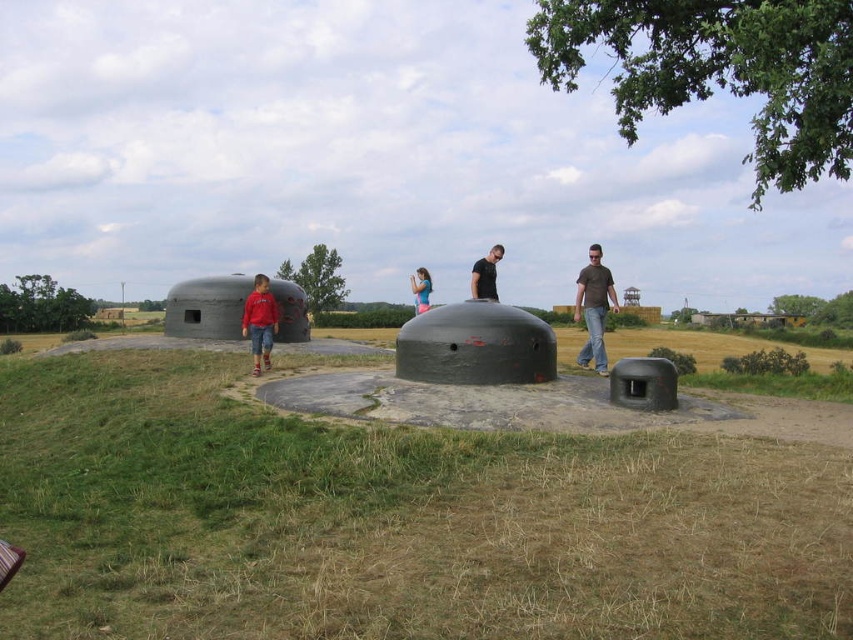
You are a photographer trying to capture a clear shot of the matte red shirt at left and the blue denim jeans at center. Since the camera can only focus on one subject at a time, which subject should you choose to ensure the larger one is in focus?

The matte red shirt at left is larger than the blue denim jeans at center, so you should focus on the matte red shirt at left to ensure the larger one is in focus.

You are standing at the point marked by the coordinates point (x=474, y=346). Looking around, what structure are you likely standing on or near?

You are likely standing on or near the matte green bunker at center, as the coordinates point (x=474, y=346) represent its location.